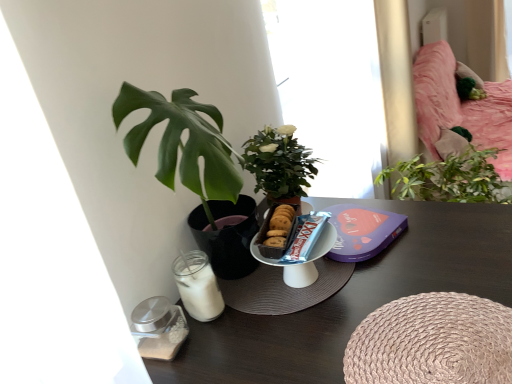
Image resolution: width=512 pixels, height=384 pixels. Find the location of `blue foil chocolate bar at center`. blue foil chocolate bar at center is located at coordinates (298, 239).

Image resolution: width=512 pixels, height=384 pixels. In order to click on pink fabric bed at upper right in this screenshot , I will do click(460, 107).

This screenshot has width=512, height=384. What do you see at coordinates (353, 299) in the screenshot?
I see `wooden table at lower left` at bounding box center [353, 299].

This screenshot has height=384, width=512. What are the coordinates of `transparent glass window at center` in the screenshot? It's located at (331, 89).

Describe the element at coordinates (432, 342) in the screenshot. This screenshot has width=512, height=384. I see `woven beige placemat at lower right` at that location.

Locate an element on the screen. blue foil chocolate bar at center is located at coordinates (298, 239).

Which is behind, woven beige placemat at lower right or wooden table at lower left?

wooden table at lower left is further from the camera.

Find the location of a particular element. table to the left of woven beige placemat at lower right is located at coordinates (353, 299).

Considering the sizes of objects woven beige placemat at lower right and wooden table at lower left in the image provided, who is thinner, woven beige placemat at lower right or wooden table at lower left?

With smaller width is woven beige placemat at lower right.

Could you tell me if woven beige placemat at lower right is turned towards wooden table at lower left?

Yes.

What's the angular difference between wooden table at lower left and pink fabric bed at upper right's facing directions?

The facing directions of wooden table at lower left and pink fabric bed at upper right are 90 degrees apart.

Between wooden table at lower left and pink fabric bed at upper right, which one appears on the left side from the viewer's perspective?

wooden table at lower left is more to the left.

Which is correct: wooden table at lower left is inside pink fabric bed at upper right, or outside of it?

wooden table at lower left is not inside pink fabric bed at upper right, it's outside.

Considering the sizes of wooden table at lower left and pink fabric bed at upper right in the image, is wooden table at lower left bigger or smaller than pink fabric bed at upper right?

wooden table at lower left is smaller than pink fabric bed at upper right.

How many degrees apart are the facing directions of pink fabric bed at upper right and woven beige placemat at lower right?

The angle between the facing direction of pink fabric bed at upper right and the facing direction of woven beige placemat at lower right is 90 degrees.

Identify the location of round table that is on the left side of pink fabric bed at upper right. The height and width of the screenshot is (384, 512). (432, 342).

Who is taller, pink fabric bed at upper right or woven beige placemat at lower right?

With more height is pink fabric bed at upper right.

Is wooden table at lower left positioned with its back to woven beige placemat at lower right?

wooden table at lower left does not have its back to woven beige placemat at lower right.

This screenshot has height=384, width=512. I want to click on round table located on the right of wooden table at lower left, so click(x=432, y=342).

Between wooden table at lower left and woven beige placemat at lower right, which one has larger width?

wooden table at lower left.

From the picture: Is wooden table at lower left further to camera compared to woven beige placemat at lower right?

Yes, the depth of wooden table at lower left is greater than that of woven beige placemat at lower right.

Which of these two, transparent glass window at center or blue foil chocolate bar at center, stands taller?

transparent glass window at center.

Considering the sizes of transparent glass window at center and blue foil chocolate bar at center in the image, is transparent glass window at center wider or thinner than blue foil chocolate bar at center?

Clearly, transparent glass window at center has more width compared to blue foil chocolate bar at center.

Considering the positions of point (309, 106) and point (310, 244), is point (309, 106) closer or farther from the camera than point (310, 244)?

Clearly, point (309, 106) is more distant from the camera than point (310, 244).

Is wooden table at lower left outside of transparent glass window at center?

Yes, wooden table at lower left is located beyond the bounds of transparent glass window at center.

Which is more to the left, wooden table at lower left or transparent glass window at center?

wooden table at lower left is more to the left.

Locate an element on the screen. table below the transparent glass window at center (from the image's perspective) is located at coordinates [353, 299].

Would you consider wooden table at lower left to be distant from transparent glass window at center?

Actually, wooden table at lower left and transparent glass window at center are a little close together.

Is pink fabric bed at upper right at the left side of transparent glass window at center?

Incorrect, pink fabric bed at upper right is not on the left side of transparent glass window at center.

Considering the sizes of pink fabric bed at upper right and transparent glass window at center in the image, is pink fabric bed at upper right bigger or smaller than transparent glass window at center?

Clearly, pink fabric bed at upper right is larger in size than transparent glass window at center.

Is pink fabric bed at upper right aimed at transparent glass window at center?

No, pink fabric bed at upper right does not turn towards transparent glass window at center.

Find the location of a particular element. The width and height of the screenshot is (512, 384). table located underneath the woven beige placemat at lower right (from a real-world perspective) is located at coordinates (353, 299).

Locate an element on the screen. The height and width of the screenshot is (384, 512). table on the left of the pink fabric bed at upper right is located at coordinates (353, 299).

Which object lies further to the anchor point pink fabric bed at upper right, blue foil chocolate bar at center or wooden table at lower left?

blue foil chocolate bar at center is positioned further to the anchor pink fabric bed at upper right.

Considering their positions, is woven beige placemat at lower right positioned closer to pink fabric bed at upper right than transparent glass window at center?

transparent glass window at center is positioned closer to the anchor pink fabric bed at upper right.

Considering their positions, is transparent glass window at center positioned closer to blue foil chocolate bar at center than pink fabric bed at upper right?

transparent glass window at center is closer to blue foil chocolate bar at center.

Which object lies nearer to the anchor point pink fabric bed at upper right, transparent glass window at center or woven beige placemat at lower right?

Among the two, transparent glass window at center is located nearer to pink fabric bed at upper right.

When comparing their distances from pink fabric bed at upper right, does blue foil chocolate bar at center or woven beige placemat at lower right seem further?

Based on the image, blue foil chocolate bar at center appears to be further to pink fabric bed at upper right.

Which object lies further to the anchor point woven beige placemat at lower right, wooden table at lower left or pink fabric bed at upper right?

pink fabric bed at upper right is positioned further to the anchor woven beige placemat at lower right.

Estimate the real-world distances between objects in this image. Which object is closer to blue foil chocolate bar at center, pink fabric bed at upper right or transparent glass window at center?

transparent glass window at center is positioned closer to the anchor blue foil chocolate bar at center.

Considering their positions, is pink fabric bed at upper right positioned further to wooden table at lower left than woven beige placemat at lower right?

pink fabric bed at upper right lies further to wooden table at lower left than the other object.

The height and width of the screenshot is (384, 512). I want to click on round table between blue foil chocolate bar at center and wooden table at lower left vertically, so click(x=432, y=342).

Where is `snack positioned between wooden table at lower left and pink fabric bed at upper right from near to far`? snack positioned between wooden table at lower left and pink fabric bed at upper right from near to far is located at coordinates (298, 239).

At what (x,y) coordinates should I click in order to perform the action: click on snack positioned between woven beige placemat at lower right and pink fabric bed at upper right from near to far. Please return your answer as a coordinate pair (x, y). The width and height of the screenshot is (512, 384). Looking at the image, I should click on (298, 239).

At what (x,y) coordinates should I click in order to perform the action: click on table between woven beige placemat at lower right and pink fabric bed at upper right along the z-axis. Please return your answer as a coordinate pair (x, y). Looking at the image, I should click on (353, 299).